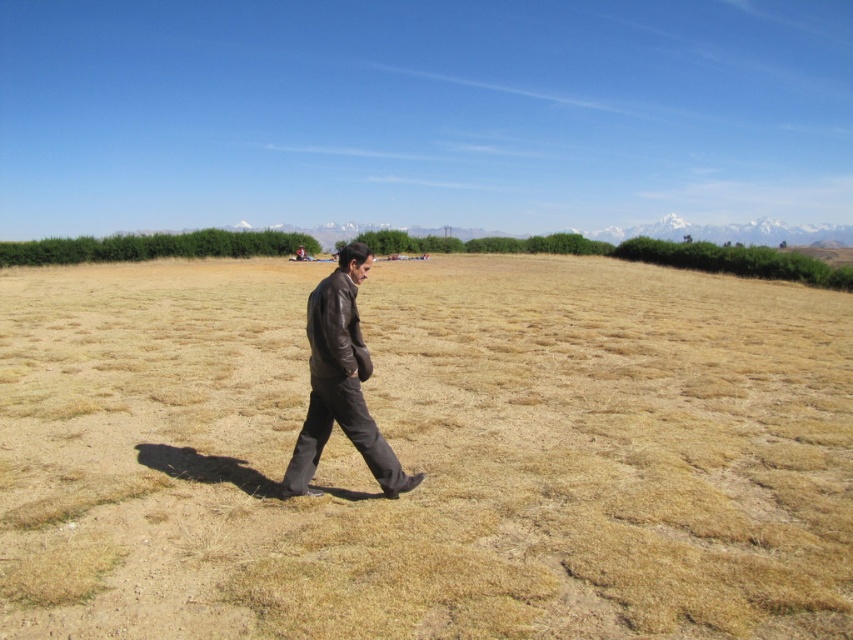
You are standing at the point marked as point (426, 452) in the image. What is the color of the ground beneath your feet?

The point (426, 452) corresponds to brown grass at center, so the ground beneath your feet is brown grass.